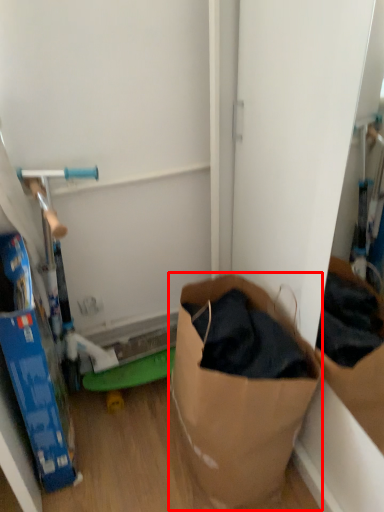
Question: From the image, what is the correct spatial relationship of paper bag (annotated by the red box) in relation to box?

Choices:
 (A) left
 (B) right

Answer: (B)